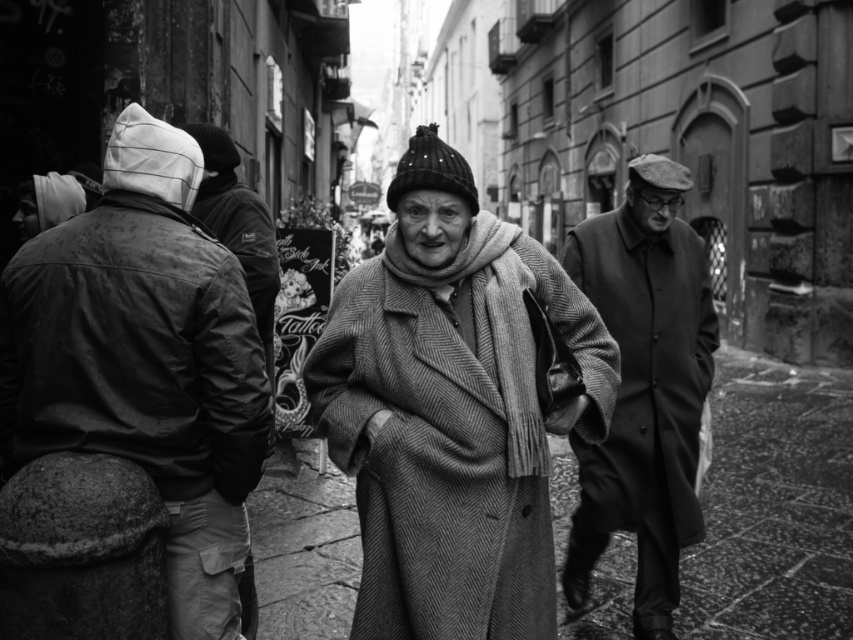
Question: Which of the following is the closest to the observer?

Choices:
 (A) herringbone wool coat at center
 (B) coarse wool scarf at center

Answer: (A)

Question: Which object is the farthest from the leather jacket at left?

Choices:
 (A) coarse wool scarf at center
 (B) herringbone wool coat at center
 (C) coarse wool coat at right

Answer: (C)

Question: Is coarse wool coat at right positioned behind coarse wool scarf at center?

Choices:
 (A) no
 (B) yes

Answer: (B)

Question: Where is leather jacket at left located in relation to coarse wool scarf at center in the image?

Choices:
 (A) below
 (B) above

Answer: (A)

Question: Is leather jacket at left thinner than coarse wool scarf at center?

Choices:
 (A) no
 (B) yes

Answer: (A)

Question: Estimate the real-world distances between objects in this image. Which object is closer to the coarse wool coat at right?

Choices:
 (A) coarse wool scarf at center
 (B) leather jacket at left

Answer: (A)